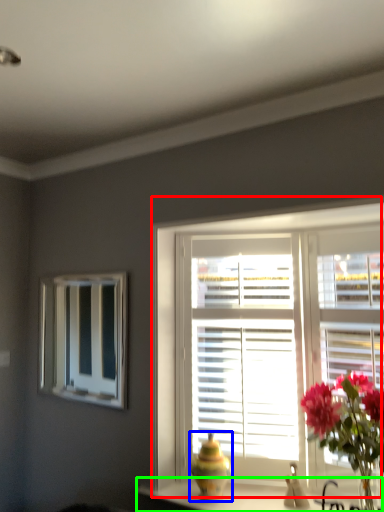
Question: Which object is the farthest from window (highlighted by a red box)? Choose among these: vase (highlighted by a blue box) or counter top (highlighted by a green box).

Choices:
 (A) vase
 (B) counter top

Answer: (B)